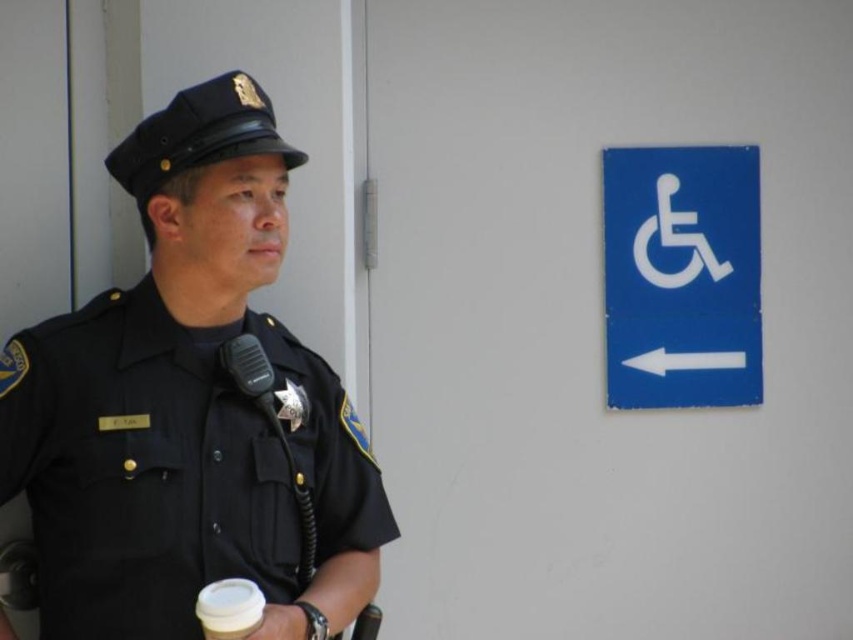
Question: Is blue metal sign at upper right to the right of white paper cup at lower center from the viewer's perspective?

Choices:
 (A) no
 (B) yes

Answer: (B)

Question: Estimate the real-world distances between objects in this image. Which object is closer to the white paper cup at lower center?

Choices:
 (A) blue metal sign at upper right
 (B) black uniform at left

Answer: (B)

Question: Is black uniform at left smaller than white paper cup at lower center?

Choices:
 (A) no
 (B) yes

Answer: (A)

Question: Which of the following is the farthest from the observer?

Choices:
 (A) (256, 614)
 (B) (157, 328)
 (C) (624, 376)

Answer: (C)

Question: Which object is the farthest from the white paper cup at lower center?

Choices:
 (A) black uniform at left
 (B) blue metal sign at upper right

Answer: (B)

Question: Can you confirm if blue metal sign at upper right is positioned to the right of white paper cup at lower center?

Choices:
 (A) no
 (B) yes

Answer: (B)